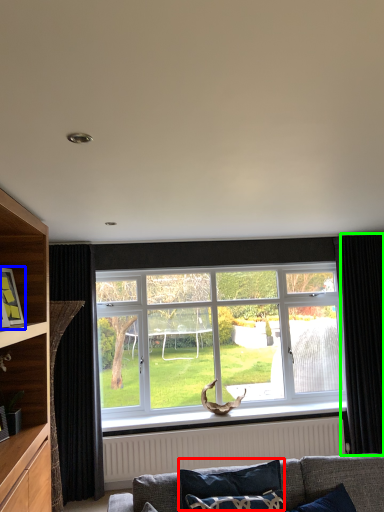
Question: Estimate the real-world distances between objects in this image. Which object is farther from pillow (highlighted by a red box), picture frame (highlighted by a blue box) or curtain (highlighted by a green box)?

Choices:
 (A) picture frame
 (B) curtain

Answer: (B)